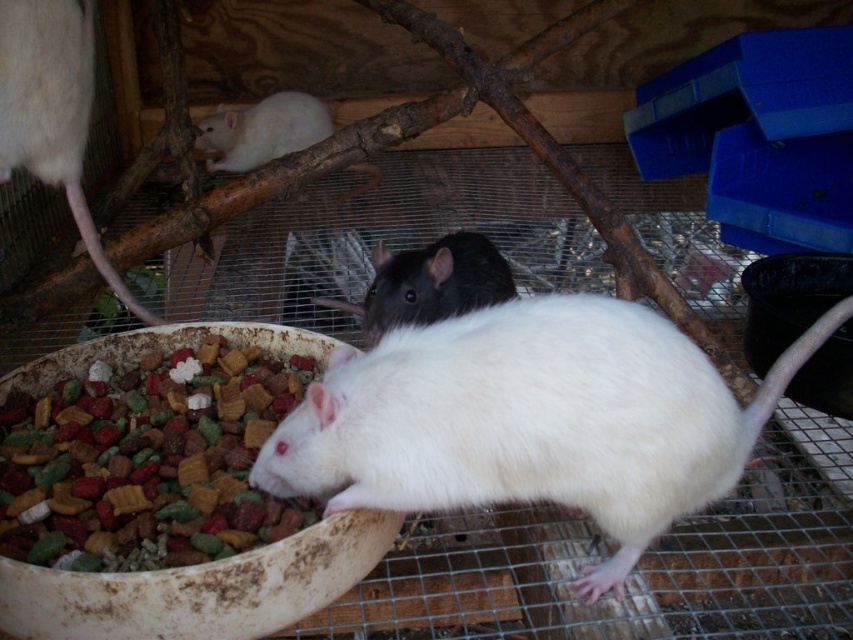
Question: Does colorful crunchy kibble at lower left have a smaller size compared to white matte/black textured mouse at upper center?

Choices:
 (A) yes
 (B) no

Answer: (A)

Question: Which object is the closest to the white matte fur mouse at center?

Choices:
 (A) white matte fur at upper left
 (B) white matte/black textured mouse at upper center

Answer: (A)

Question: Which is nearer to the white matte/black textured mouse at upper center?

Choices:
 (A) white matte fur at upper left
 (B) colorful crunchy kibble at lower left

Answer: (A)

Question: Is white matte fur mouse at center below colorful crunchy kibble at lower left?

Choices:
 (A) yes
 (B) no

Answer: (A)

Question: Is white matte fur mouse at center thinner than white matte fur at upper left?

Choices:
 (A) yes
 (B) no

Answer: (B)

Question: Among these points, which one is farthest from the camera?

Choices:
 (A) (265, 160)
 (B) (61, 28)

Answer: (A)